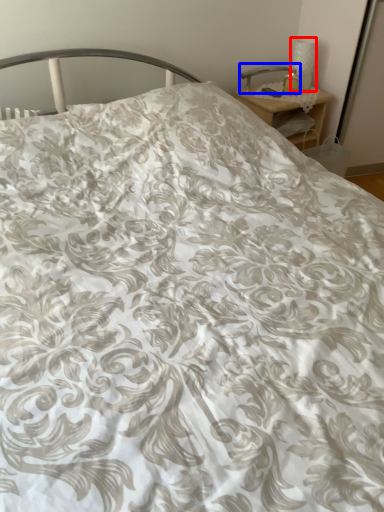
Question: Which point is further to the camera, table lamp (highlighted by a red box) or table lamp (highlighted by a blue box)?

Choices:
 (A) table lamp
 (B) table lamp

Answer: (B)